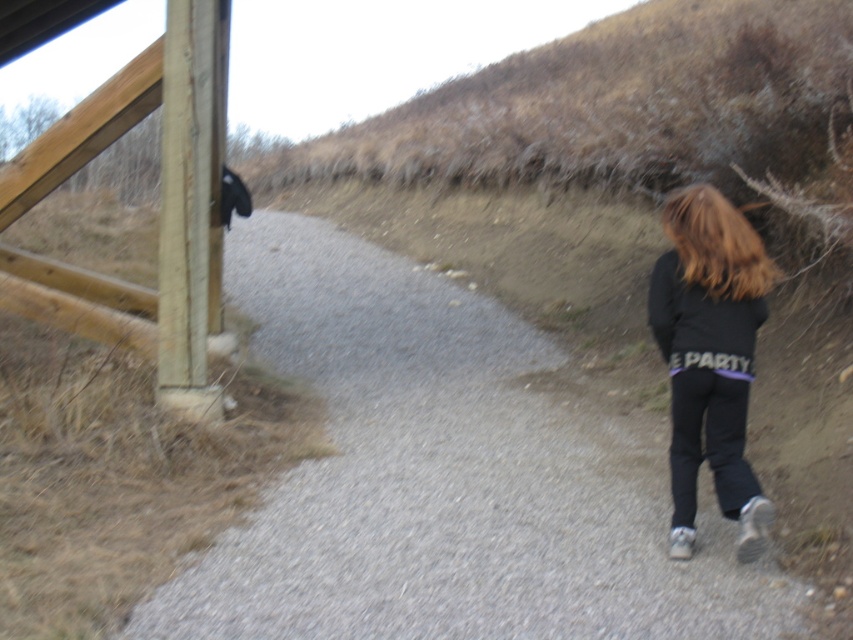
Find the location of `black matte sweatshirt at lower right`. black matte sweatshirt at lower right is located at coordinates (701, 323).

Where is `black matte sweatshirt at lower right`? This screenshot has height=640, width=853. black matte sweatshirt at lower right is located at coordinates (701, 323).

Identify the location of black matte sweatshirt at lower right. (701, 323).

Is gray gravel path at center closer to the viewer compared to black matte sweatshirt at lower right?

Yes, gray gravel path at center is in front of black matte sweatshirt at lower right.

Between gray gravel path at center and black matte sweatshirt at lower right, which one is positioned lower?

gray gravel path at center is below.

Is point (573, 426) farther from camera compared to point (705, 348)?

Yes, it is.

The image size is (853, 640). I want to click on gray gravel path at center, so click(448, 477).

Does point (178, 106) come in front of point (730, 355)?

No, (178, 106) is further to viewer.

Can you confirm if light brown wooden rail at left is positioned above black matte pants at right?

Correct, light brown wooden rail at left is located above black matte pants at right.

Describe the element at coordinates (160, 182) in the screenshot. I see `light brown wooden rail at left` at that location.

In order to click on light brown wooden rail at left in this screenshot , I will do `click(160, 182)`.